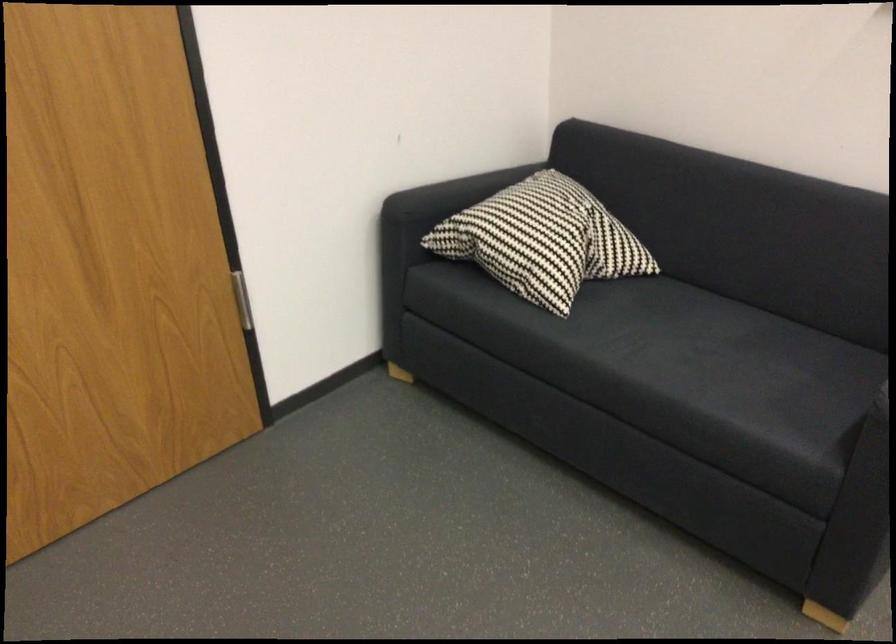
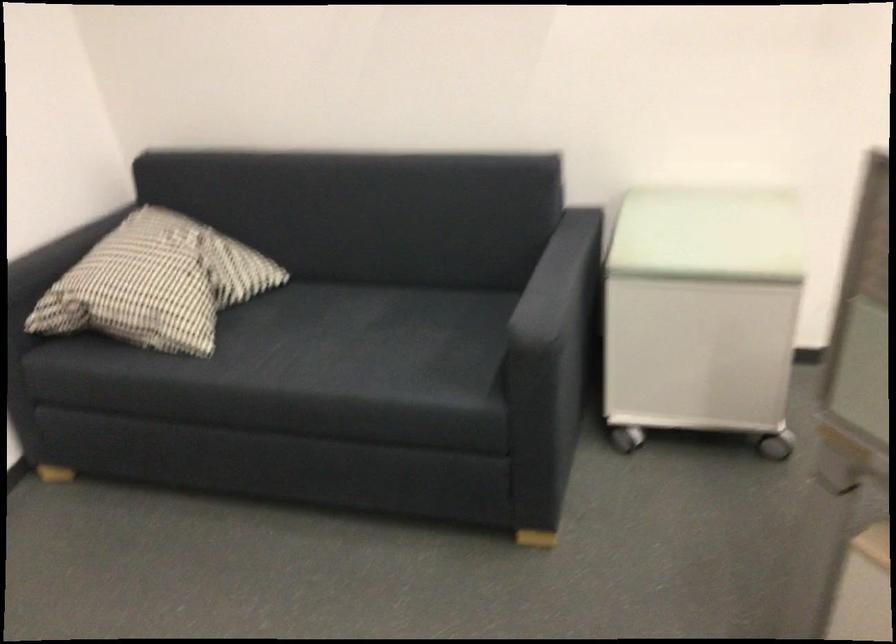
Find the pixel in the second image that matches point 536,236 in the first image.

(156, 283)